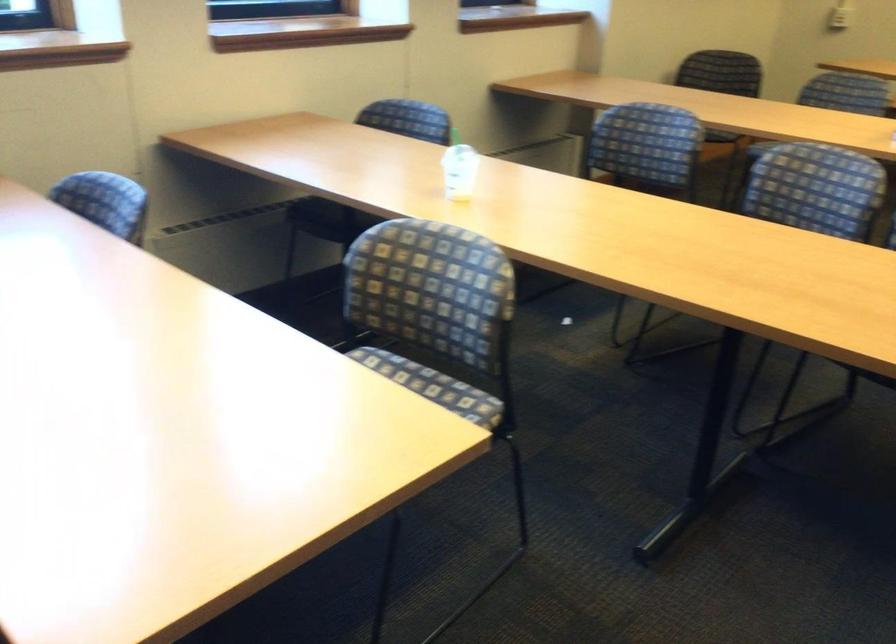
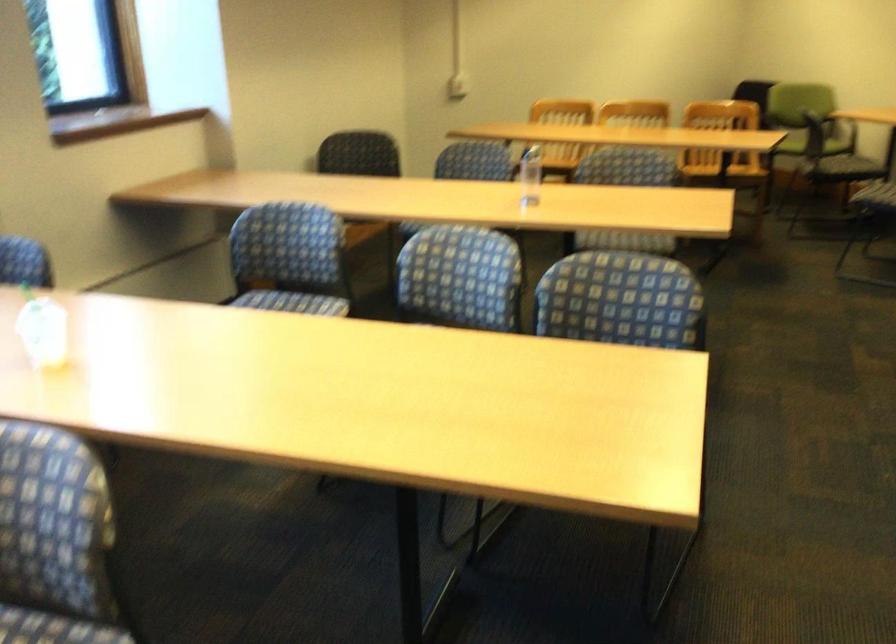
Find the pixel in the second image that matches (x=463, y=310) in the first image.

(54, 540)